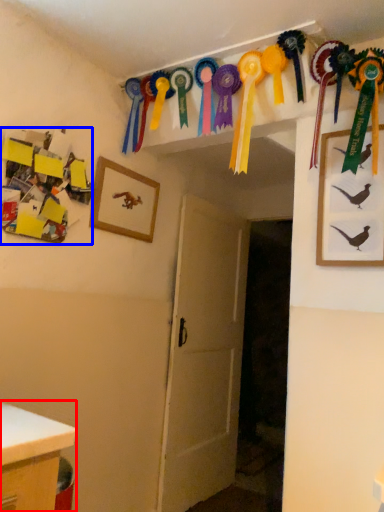
Question: Which object appears closest to the camera in this image, desk (highlighted by a red box) or art (highlighted by a blue box)?

Choices:
 (A) desk
 (B) art

Answer: (A)